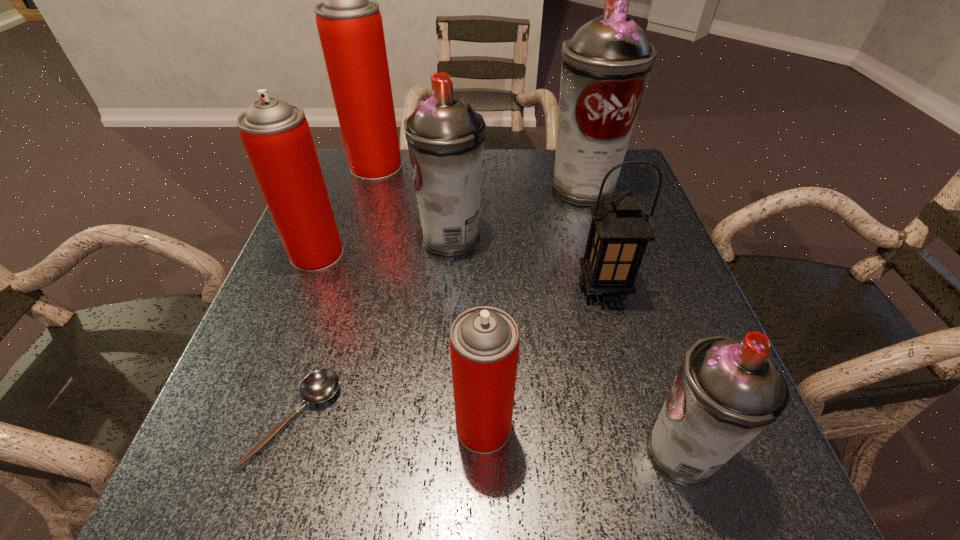
At what (x,y) coordinates should I click in order to perform the action: click on vacant space that is in between the biggest gray aerosol can and the nearest gray aerosol can. Please return your answer as a coordinate pair (x, y). Image resolution: width=960 pixels, height=540 pixels. Looking at the image, I should click on (632, 321).

This screenshot has width=960, height=540. I want to click on vacant space that is in between the second smallest gray aerosol can and the shortest object, so click(372, 329).

Image resolution: width=960 pixels, height=540 pixels. I want to click on free space between the biggest red aerosol can and the shortest object, so click(335, 293).

Locate an element on the screen. Image resolution: width=960 pixels, height=540 pixels. free space between the second smallest red aerosol can and the second biggest gray aerosol can is located at coordinates (384, 246).

Where is `free space between the black lantern and the ladle`? free space between the black lantern and the ladle is located at coordinates (449, 354).

Image resolution: width=960 pixels, height=540 pixels. What are the coordinates of `vacant region between the smallest red aerosol can and the second farthest red aerosol can` in the screenshot? It's located at (400, 341).

Locate an element on the screen. The height and width of the screenshot is (540, 960). free spot between the second smallest red aerosol can and the shortest object is located at coordinates (306, 337).

Where is `vacant point located between the smallest red aerosol can and the nearest gray aerosol can`? This screenshot has height=540, width=960. vacant point located between the smallest red aerosol can and the nearest gray aerosol can is located at coordinates (583, 440).

Locate an element on the screen. The width and height of the screenshot is (960, 540). blank region between the second nearest red aerosol can and the gray ladle is located at coordinates (306, 337).

You are a GUI agent. You are given a task and a screenshot of the screen. Output one action in this format:
    pyautogui.click(x=<x>, y=<y>)
    Task: Click on the object that is the fourth closest to the rightmost red aerosol can
    The height and width of the screenshot is (540, 960).
    Given the screenshot: What is the action you would take?
    pyautogui.click(x=445, y=136)